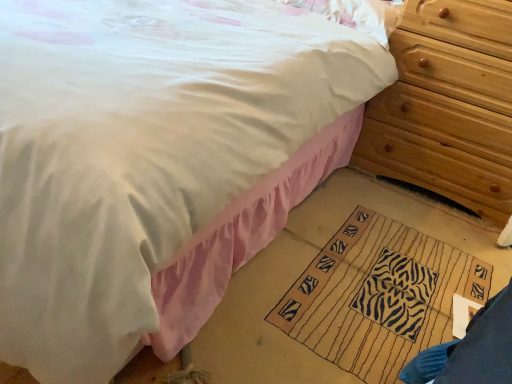
The height and width of the screenshot is (384, 512). Identify the location of free spot above beige woven mat at lower center (from a real-world perspective). (392, 292).